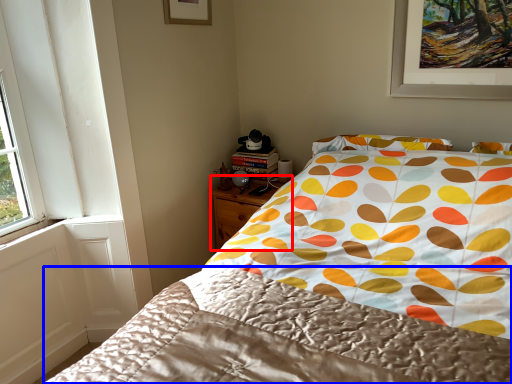
Question: Which object is closer to the camera taking this photo, nightstand (highlighted by a red box) or blanket (highlighted by a blue box)?

Choices:
 (A) nightstand
 (B) blanket

Answer: (B)